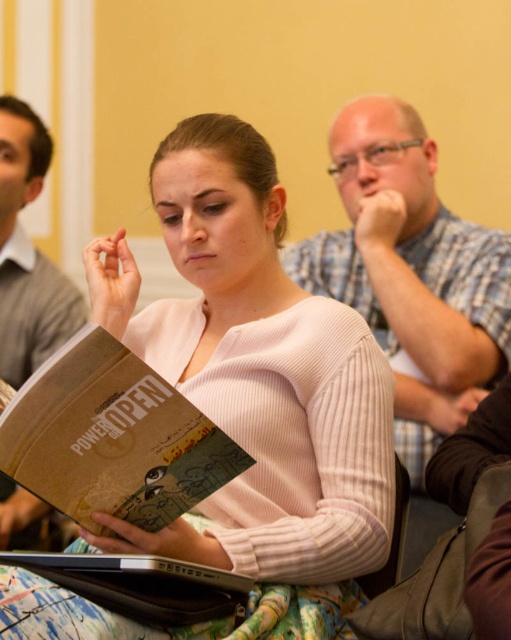
Is matte gray sweater at center to the left of brown fabric chair at lower right from the viewer's perspective?

Yes, matte gray sweater at center is to the left of brown fabric chair at lower right.

Between matte gray sweater at center and brown fabric chair at lower right, which one appears on the right side from the viewer's perspective?

Positioned to the right is brown fabric chair at lower right.

Which is behind, point (2, 529) or point (396, 470)?

Point (2, 529)

The width and height of the screenshot is (511, 640). In order to click on matte gray sweater at center in this screenshot , I will do `click(28, 253)`.

Does pink ribbed sweater at center appear on the left side of brown cardboard book at center?

Incorrect, pink ribbed sweater at center is not on the left side of brown cardboard book at center.

Who is more forward, (313, 436) or (34, 387)?

Point (34, 387) is more forward.

Identify the location of pink ribbed sweater at center. The image size is (511, 640). (243, 404).

Can you confirm if plaid shirt at upper right is bigger than brown fabric chair at lower right?

Yes.

Describe the element at coordinates (411, 273) in the screenshot. I see `plaid shirt at upper right` at that location.

Who is more forward, (365, 170) or (402, 493)?

Point (402, 493)

Find the location of a particular element. plaid shirt at upper right is located at coordinates (411, 273).